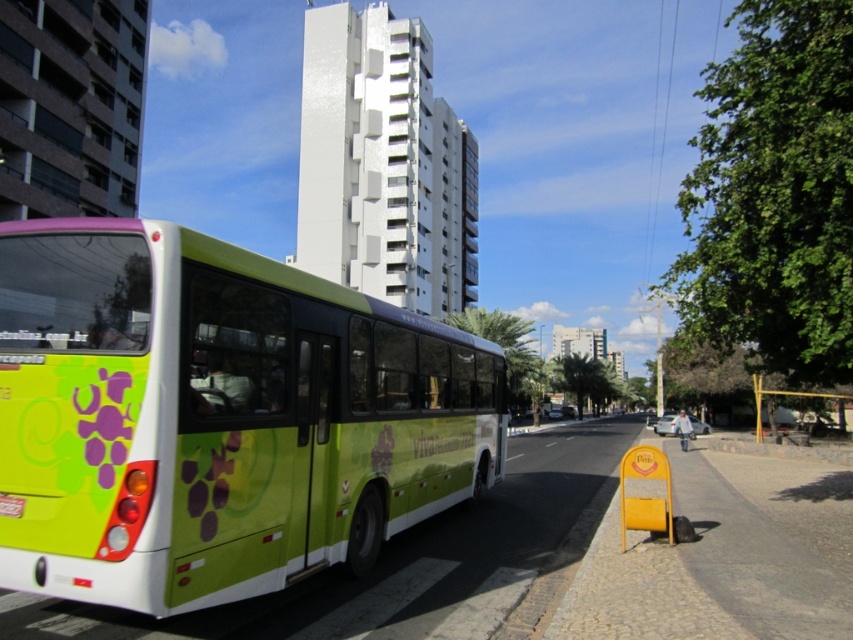
Does point (151, 472) lie behind point (640, 477)?

No, (151, 472) is closer to viewer.

Does point (236, 477) come in front of point (631, 513)?

Yes, point (236, 477) is closer to viewer.

The image size is (853, 640). Find the location of `green matte bus at left`. green matte bus at left is located at coordinates (218, 417).